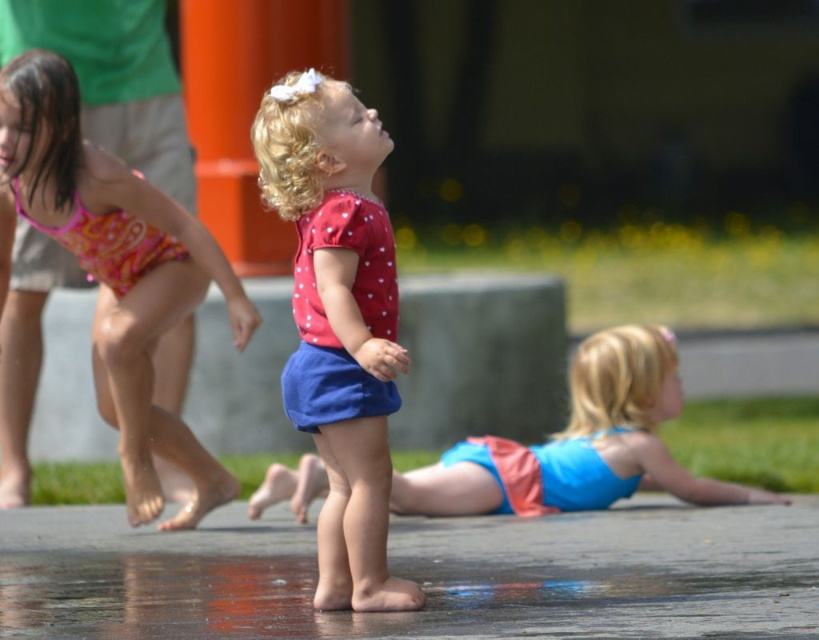
Question: Which object is the closest to the matte blue shorts at center?

Choices:
 (A) pink fabric swimsuit at left
 (B) wet concrete pavement at center

Answer: (B)

Question: Is wet concrete pavement at center smaller than matte blue shorts at center?

Choices:
 (A) yes
 (B) no

Answer: (A)

Question: Is matte red shirt at center below pink fabric swimsuit at left?

Choices:
 (A) yes
 (B) no

Answer: (A)

Question: Which object is farther from the camera taking this photo?

Choices:
 (A) wet concrete pavement at center
 (B) matte blue shorts at center

Answer: (B)

Question: Which object is positioned farthest from the matte red shirt at center?

Choices:
 (A) wet concrete pavement at center
 (B) pink fabric swimsuit at left
 (C) matte blue shorts at center

Answer: (C)

Question: Is wet concrete pavement at center to the left of pink fabric swimsuit at left from the viewer's perspective?

Choices:
 (A) no
 (B) yes

Answer: (A)